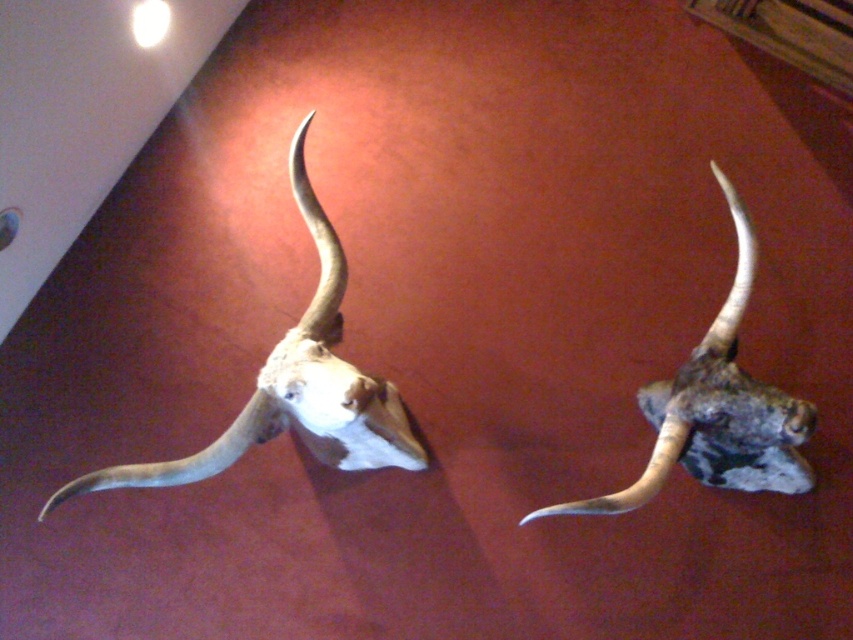
Question: Which object appears farthest from the camera in this image?

Choices:
 (A) white bone skull at center
 (B) rustic wood moose head at right

Answer: (B)

Question: Can you confirm if white bone skull at center is wider than rustic wood moose head at right?

Choices:
 (A) yes
 (B) no

Answer: (A)

Question: Which of the following is the closest to the observer?

Choices:
 (A) [x=267, y=401]
 (B) [x=784, y=454]

Answer: (A)

Question: Does white bone skull at center lie behind rustic wood moose head at right?

Choices:
 (A) yes
 (B) no

Answer: (B)

Question: Can you confirm if white bone skull at center is positioned to the right of rustic wood moose head at right?

Choices:
 (A) no
 (B) yes

Answer: (A)